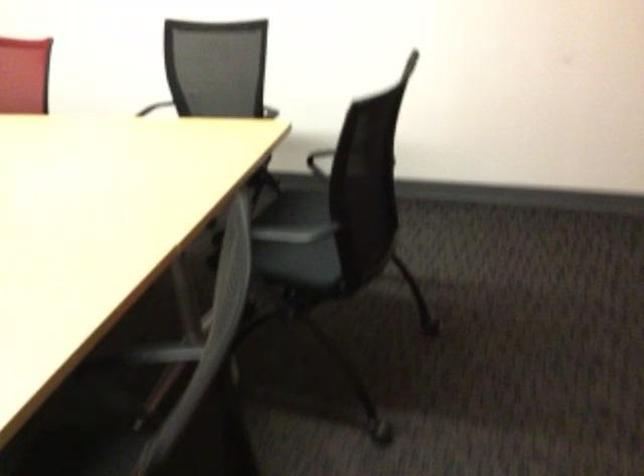
This screenshot has height=476, width=644. Describe the element at coordinates (319, 161) in the screenshot. I see `a black chair armrest` at that location.